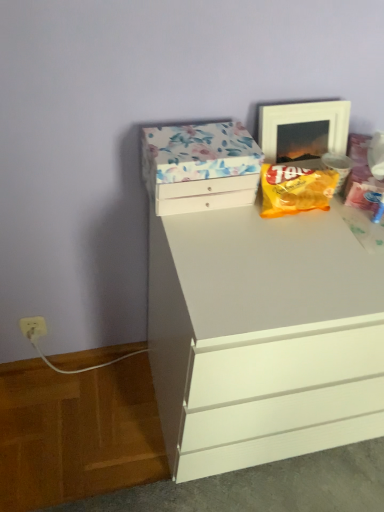
Find the location of `free space to the left of yellow matte snack packet at upper right`. free space to the left of yellow matte snack packet at upper right is located at coordinates (225, 226).